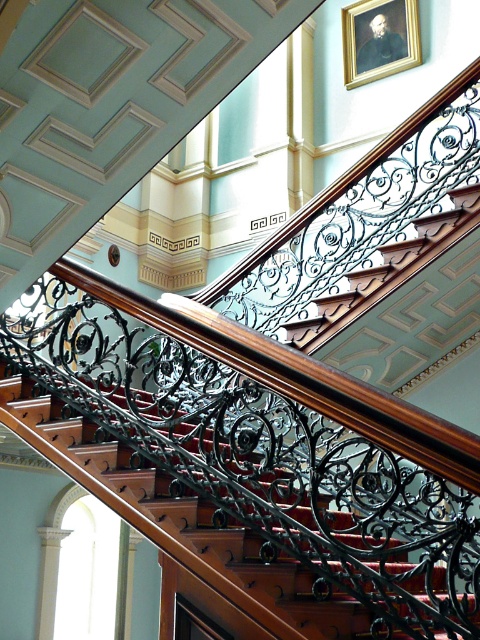
Which of these two, polished wood stairs at center or gold-framed portrait at upper right, stands taller?

With more height is polished wood stairs at center.

Can you confirm if polished wood stairs at center is shorter than gold-framed portrait at upper right?

No, polished wood stairs at center is not shorter than gold-framed portrait at upper right.

Does point (231, 564) come behind point (370, 4)?

No.

The height and width of the screenshot is (640, 480). In order to click on polished wood stairs at center in this screenshot , I will do `click(181, 522)`.

Is gold-framed portrait at upper right above oil painting portrait at upper center?

Indeed, gold-framed portrait at upper right is positioned over oil painting portrait at upper center.

Does point (350, 64) come closer to viewer compared to point (387, 22)?

No, (350, 64) is behind (387, 22).

Is point (383, 17) positioned in front of point (371, 64)?

No.

This screenshot has width=480, height=640. I want to click on gold-framed portrait at upper right, so click(379, 38).

Can you confirm if polished wood stairs at center is taller than oil painting portrait at upper center?

Indeed, polished wood stairs at center has a greater height compared to oil painting portrait at upper center.

The height and width of the screenshot is (640, 480). Find the location of `polished wood stairs at center`. polished wood stairs at center is located at coordinates (181, 522).

Is point (156, 490) closer to camera compared to point (383, 10)?

Yes, it is in front of point (383, 10).

Find the location of `polished wood stairs at center`. polished wood stairs at center is located at coordinates (181, 522).